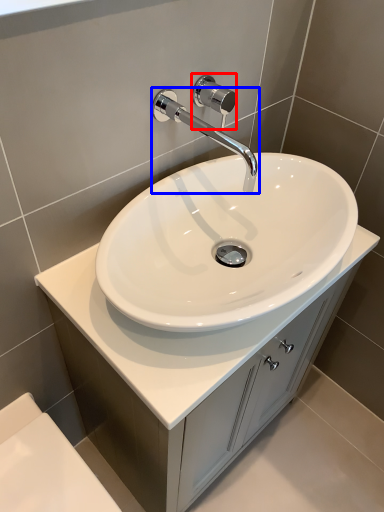
Question: Among these objects, which one is nearest to the camera, shower (highlighted by a red box) or tap (highlighted by a blue box)?

Choices:
 (A) shower
 (B) tap

Answer: (B)